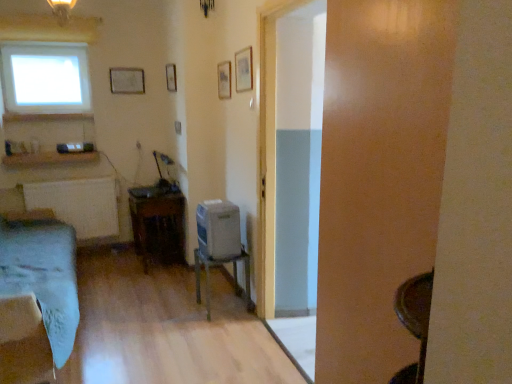
Question: From the image's perspective, would you say wooden table at center, the 1th table from the back, is positioned over wooden picture frame at upper center, which ranks as the second picture frame in left-to-right order?

Choices:
 (A) no
 (B) yes

Answer: (A)

Question: Is wooden picture frame at upper center, the 3th picture frame in the right-to-left sequence, surrounded by wooden table at center, the 1th table from the back?

Choices:
 (A) yes
 (B) no

Answer: (B)

Question: Can you confirm if wooden table at center, which ranks as the second table in right-to-left order, is wider than wooden picture frame at upper center, which ranks as the second picture frame in left-to-right order?

Choices:
 (A) no
 (B) yes

Answer: (B)

Question: From a real-world perspective, is wooden table at center, the 1th table from the back, beneath wooden picture frame at upper center, marked as the second picture frame in a back-to-front arrangement?

Choices:
 (A) no
 (B) yes

Answer: (B)

Question: Can you confirm if wooden table at center, the second table from the front, is smaller than wooden picture frame at upper center, the 3th picture frame in the front-to-back sequence?

Choices:
 (A) no
 (B) yes

Answer: (A)

Question: In terms of width, does matte white picture frame at upper center, acting as the 4th picture frame starting from the right, look wider or thinner when compared to metallic gray table at center, which is the 1th table in right-to-left order?

Choices:
 (A) wide
 (B) thin

Answer: (B)

Question: Would you say matte white picture frame at upper center, positioned as the first picture frame in back-to-front order, is inside or outside metallic gray table at center, which ranks as the second table in left-to-right order?

Choices:
 (A) outside
 (B) inside

Answer: (A)

Question: Is point (118, 79) positioned closer to the camera than point (196, 276)?

Choices:
 (A) closer
 (B) farther

Answer: (B)

Question: From their relative heights in the image, would you say matte white picture frame at upper center, which ranks as the fourth picture frame in front-to-back order, is taller or shorter than metallic gray table at center, which is the first table from front to back?

Choices:
 (A) short
 (B) tall

Answer: (A)

Question: Looking at their shapes, would you say matte white picture frame at upper center, positioned as the first picture frame in back-to-front order, is wider or thinner than satin silver desktop at center?

Choices:
 (A) thin
 (B) wide

Answer: (A)

Question: Is matte white picture frame at upper center, acting as the 4th picture frame starting from the right, in front of or behind satin silver desktop at center in the image?

Choices:
 (A) front
 (B) behind

Answer: (B)

Question: From the image's perspective, is matte white picture frame at upper center, positioned as the first picture frame in back-to-front order, positioned above or below satin silver desktop at center?

Choices:
 (A) above
 (B) below

Answer: (A)

Question: Considering the relative positions of matte white picture frame at upper center, the first picture frame when ordered from left to right, and satin silver desktop at center in the image provided, is matte white picture frame at upper center, the first picture frame when ordered from left to right, to the left or to the right of satin silver desktop at center?

Choices:
 (A) left
 (B) right

Answer: (A)

Question: In the image, is white matte radiator at left on the left side or the right side of satin silver desktop at center?

Choices:
 (A) left
 (B) right

Answer: (A)

Question: In the image, is white matte radiator at left positioned in front of or behind satin silver desktop at center?

Choices:
 (A) front
 (B) behind

Answer: (B)